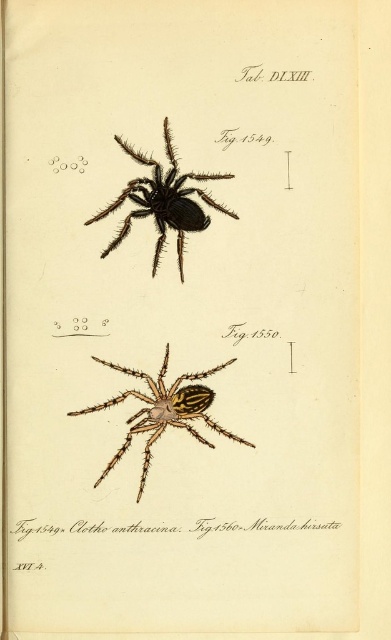
You are standing 5 feet away from the image. Is the point at coordinates point (179, 180) closer to you or farther than your current position?

The point at coordinates point (179, 180) is 4.65 feet away from the viewer, which is slightly closer than your current position of 5 feet. Therefore, it is closer to you.